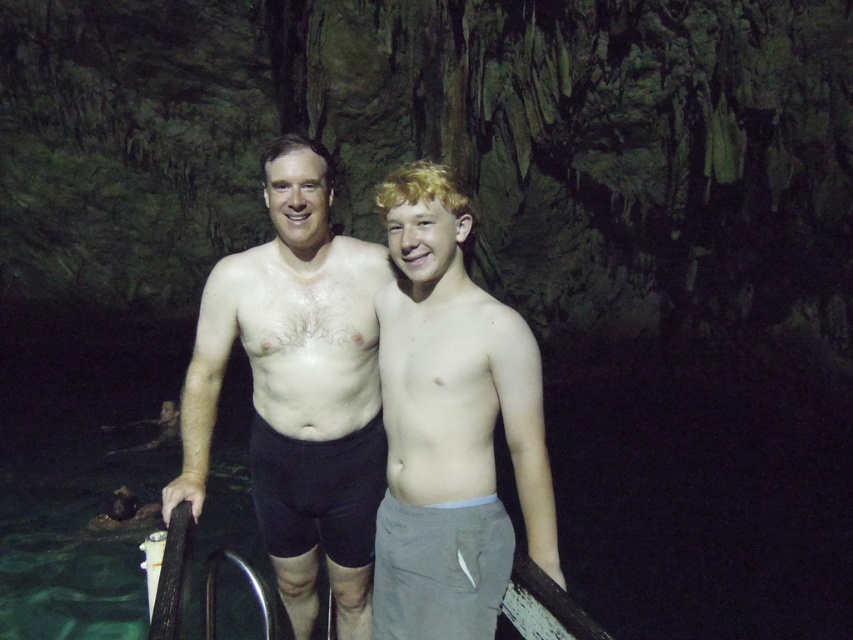
Question: From the image, what is the correct spatial relationship of smooth skin torso at center in relation to light brown cotton shorts at center?

Choices:
 (A) above
 (B) below

Answer: (B)

Question: Where is smooth skin torso at center located in relation to light brown cotton shorts at center in the image?

Choices:
 (A) right
 (B) left

Answer: (B)

Question: Does smooth skin torso at center have a smaller size compared to light brown cotton shorts at center?

Choices:
 (A) no
 (B) yes

Answer: (A)